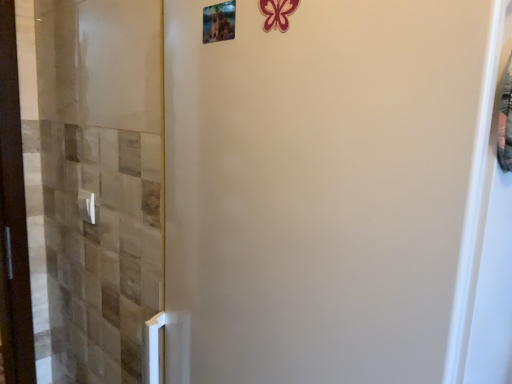
Where is `white plastic door handle at lower left`? This screenshot has width=512, height=384. white plastic door handle at lower left is located at coordinates (87, 206).

Describe the element at coordinates (87, 206) in the screenshot. This screenshot has width=512, height=384. I see `white plastic door handle at lower left` at that location.

Identify the location of metallic photo frame at upper center. (219, 22).

The width and height of the screenshot is (512, 384). Describe the element at coordinates (219, 22) in the screenshot. I see `metallic photo frame at upper center` at that location.

At what (x,y) coordinates should I click in order to perform the action: click on white plastic door handle at lower left. Please return your answer as a coordinate pair (x, y). Looking at the image, I should click on (87, 206).

Based on their positions, is metallic photo frame at upper center located to the left or right of white plastic door handle at lower left?

From the image, it's evident that metallic photo frame at upper center is to the right of white plastic door handle at lower left.

Who is more distant, metallic photo frame at upper center or white plastic door handle at lower left?

Positioned behind is white plastic door handle at lower left.

Which point is more forward, (214, 6) or (94, 209)?

The point (214, 6) is more forward.

Based on the photo, from the image's perspective, which one is positioned lower, metallic photo frame at upper center or white plastic door handle at lower left?

white plastic door handle at lower left, from the image's perspective.

From a real-world perspective, who is located lower, metallic photo frame at upper center or white plastic door handle at lower left?

In real-world perspective, white plastic door handle at lower left is lower.

Between metallic photo frame at upper center and white plastic door handle at lower left, which one has smaller width?

Thinner between the two is metallic photo frame at upper center.

Does metallic photo frame at upper center have a greater height compared to white plastic door handle at lower left?

Incorrect, the height of metallic photo frame at upper center is not larger of that of white plastic door handle at lower left.

Who is smaller, metallic photo frame at upper center or white plastic door handle at lower left?

Smaller between the two is metallic photo frame at upper center.

Is metallic photo frame at upper center not within white plastic door handle at lower left?

Indeed, metallic photo frame at upper center is completely outside white plastic door handle at lower left.

Are metallic photo frame at upper center and white plastic door handle at lower left making contact?

They are not placed beside each other.

From the picture: Is metallic photo frame at upper center aimed at white plastic door handle at lower left?

No, metallic photo frame at upper center is not aimed at white plastic door handle at lower left.

How many degrees apart are the facing directions of metallic photo frame at upper center and white plastic door handle at lower left?

metallic photo frame at upper center and white plastic door handle at lower left are facing 2.08 degrees away from each other.

Find the location of `picture frame above the white plastic door handle at lower left (from the image's perspective)`. picture frame above the white plastic door handle at lower left (from the image's perspective) is located at coordinates (219, 22).

Can you confirm if white plastic door handle at lower left is positioned to the left of metallic photo frame at upper center?

Yes.

Considering the relative positions of white plastic door handle at lower left and metallic photo frame at upper center in the image provided, is white plastic door handle at lower left in front of metallic photo frame at upper center?

No, white plastic door handle at lower left is further to the viewer.

Is point (85, 190) closer or farther from the camera than point (218, 35)?

Point (85, 190) is positioned farther from the camera compared to point (218, 35).

From the image's perspective, which is below, white plastic door handle at lower left or metallic photo frame at upper center?

From the image's view, white plastic door handle at lower left is below.

From a real-world perspective, is white plastic door handle at lower left physically located above or below metallic photo frame at upper center?

From a real-world perspective, white plastic door handle at lower left is physically below metallic photo frame at upper center.

Does white plastic door handle at lower left have a greater width compared to metallic photo frame at upper center?

Yes.

Which of these two, white plastic door handle at lower left or metallic photo frame at upper center, stands shorter?

With less height is metallic photo frame at upper center.

From the picture: Can you confirm if white plastic door handle at lower left is bigger than metallic photo frame at upper center?

Yes, white plastic door handle at lower left is bigger than metallic photo frame at upper center.

Is white plastic door handle at lower left not within metallic photo frame at upper center?

That's correct, white plastic door handle at lower left is outside of metallic photo frame at upper center.

Are white plastic door handle at lower left and metallic photo frame at upper center beside each other?

No, white plastic door handle at lower left is not in contact with metallic photo frame at upper center.

Is white plastic door handle at lower left aimed at metallic photo frame at upper center?

No, white plastic door handle at lower left is not facing towards metallic photo frame at upper center.

At what (x,y) coordinates should I click in order to perform the action: click on door handle that is below the metallic photo frame at upper center (from the image's perspective). Please return your answer as a coordinate pair (x, y). Looking at the image, I should click on (87, 206).

The width and height of the screenshot is (512, 384). Find the location of `door handle on the left of metallic photo frame at upper center`. door handle on the left of metallic photo frame at upper center is located at coordinates (87, 206).

At what (x,y) coordinates should I click in order to perform the action: click on door handle lying behind the metallic photo frame at upper center. Please return your answer as a coordinate pair (x, y). Looking at the image, I should click on (87, 206).